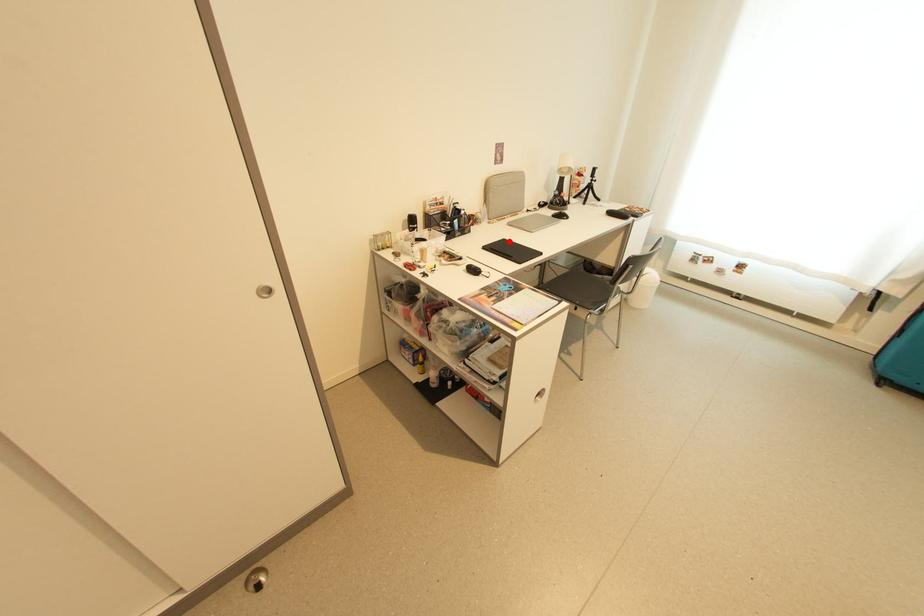
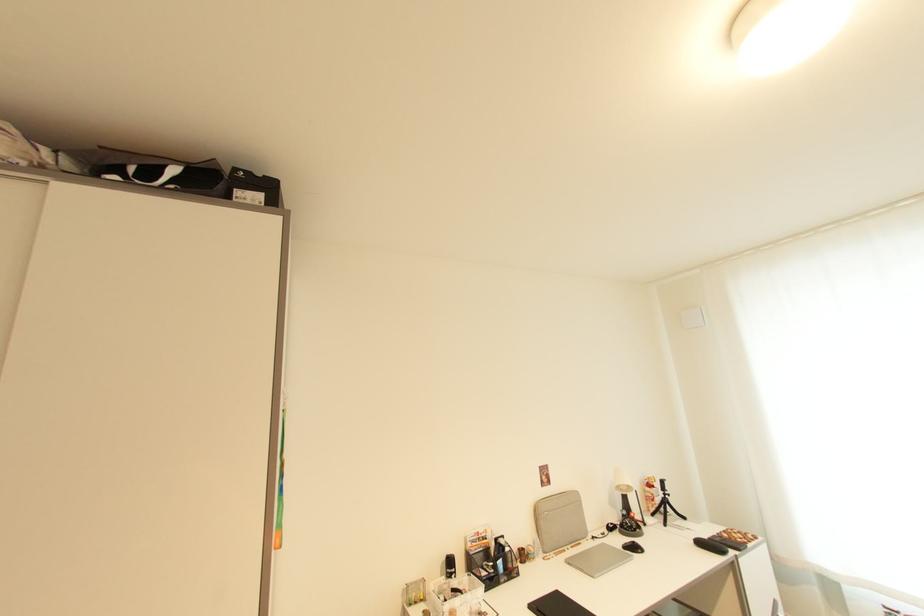
In the second image, find the point that corresponds to the highlighted location in the first image.

(562, 594)